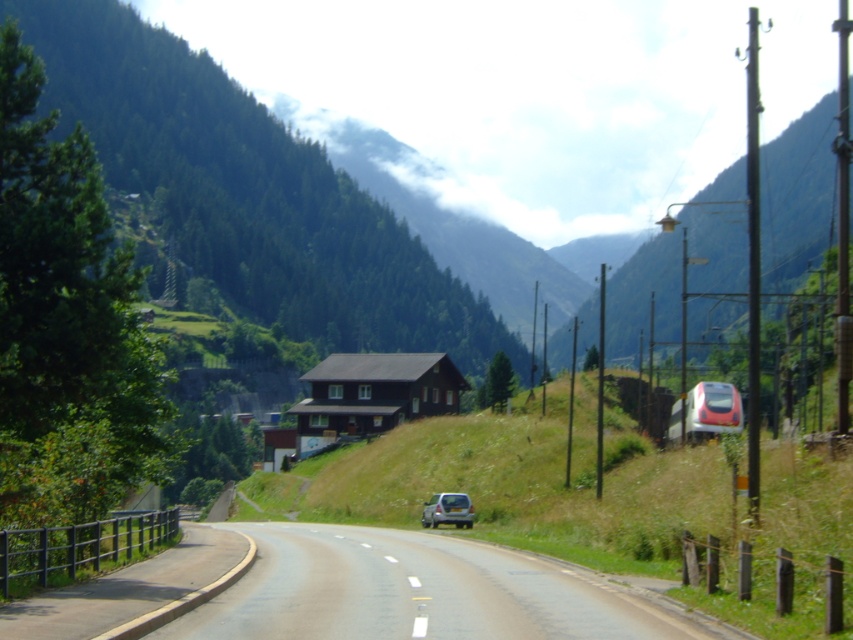
You are a driver approaching the smooth asphalt road at center and the silver metallic suv at center. Which one will you encounter first?

The silver metallic suv at center will be encountered first because it is positioned closer to the driver than the smooth asphalt road at center.

From the picture: You are driving a car and want to park near the silver metallic suv at center. Based on the scene, can you determine if the smooth asphalt road at center is wide enough to allow safe parking without blocking the road?

The smooth asphalt road at center is closer to the viewer than the silver metallic suv at center, but the description does not provide specific width measurements. Therefore, it is unclear if the road is wide enough for safe parking without blocking traffic.